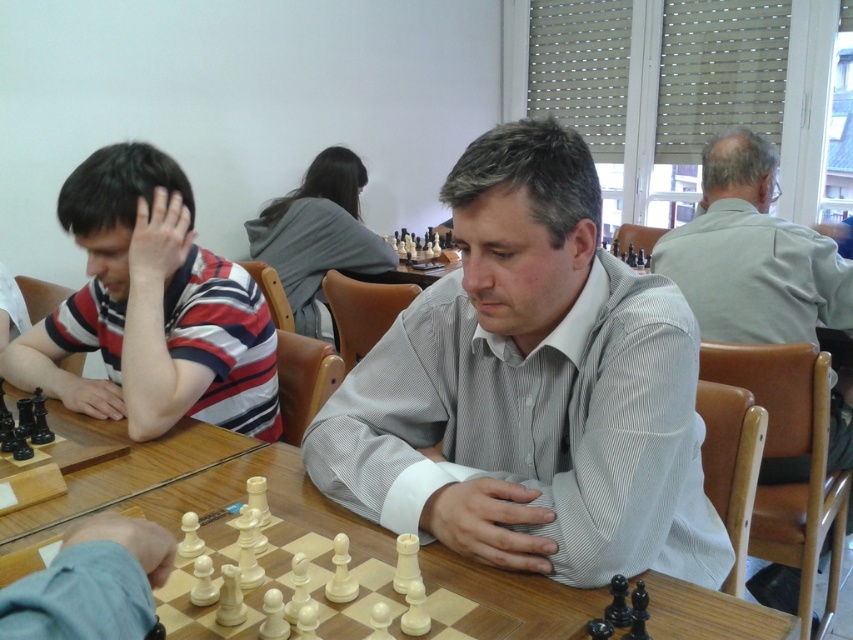
In the scene shown: You are a chess player who wants to approach the light gray shirt at upper right to discuss a strategy. The minimum distance you need to move is 1.90 meters. Is this possible?

Yes, because the light gray shirt at upper right is 1.90 meters away, which meets the minimum distance requirement.

You are a photographer trying to capture a wide shot of the chess tournament. The light gray shirt at upper right and the wooden at center are both in your frame. If you want to ensure both objects are fully visible without cropping, which object requires more space in the frame?

The wooden at center requires more space in the frame because its width is greater than the light gray shirt at upper right.

You are a photographer standing at the center of the chess tournament room. You want to take a photo of the striped cotton shirt at left and the man in light gray striped shirt at right. How far apart are the two subjects?

The striped cotton shirt at left and the man in light gray striped shirt at right are 1.44 meters apart.